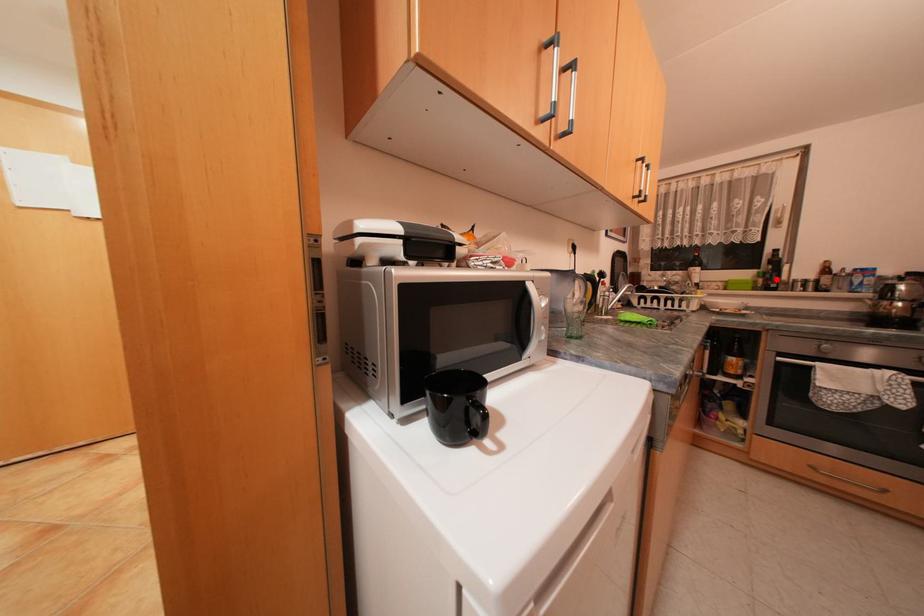
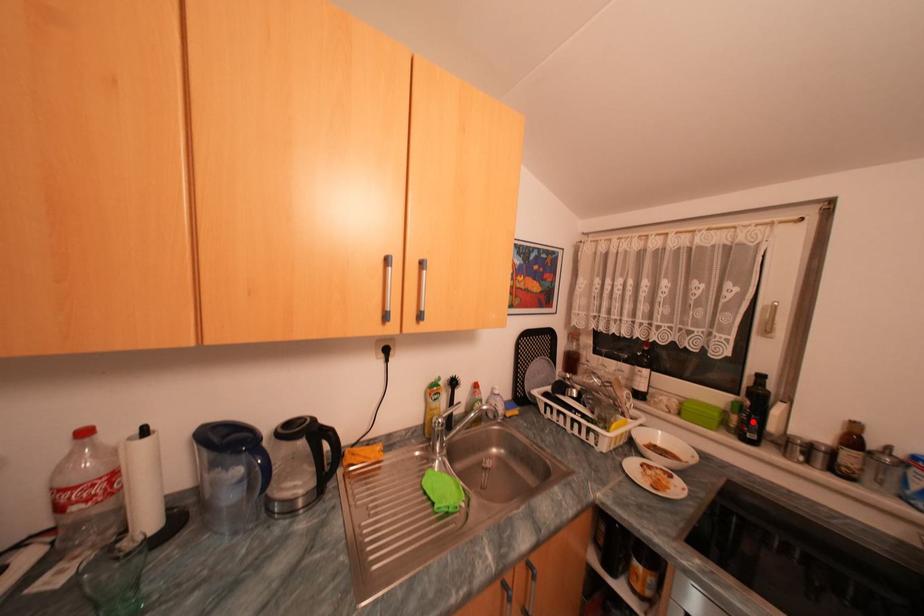
I am providing you with two images of the same scene from different viewpoints. A red point is marked on the first image and another point is marked on the second image. Is the marked point in image1 the same physical position as the marked point in image2?

Yes